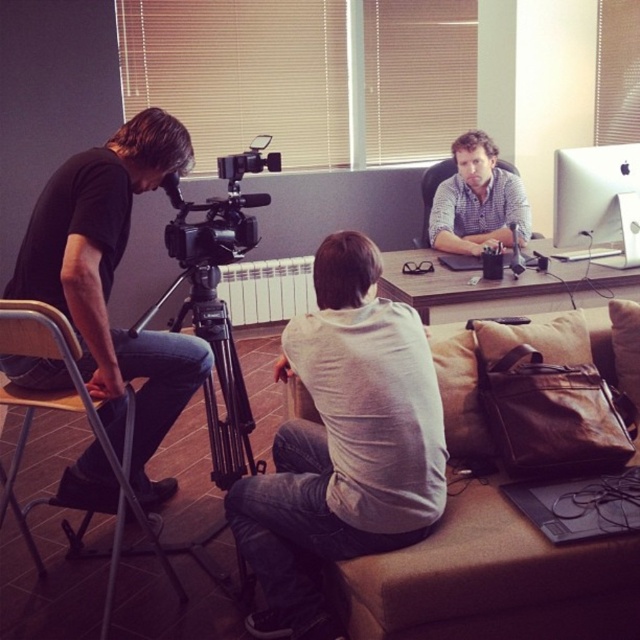
Question: Among these objects, which one is nearest to the camera?

Choices:
 (A) black metal tripod at left
 (B) wooden desk at center

Answer: (A)

Question: Among these points, which one is farthest from the camera?

Choices:
 (A) (529, 550)
 (B) (68, 296)

Answer: (B)

Question: Among these objects, which one is farthest from the camera?

Choices:
 (A) wooden desk at center
 (B) black metal tripod at left
 (C) white cotton shirt at center
 (D) checkered shirt at center

Answer: (D)

Question: Is white cotton shirt at center bigger than black matte camera at left?

Choices:
 (A) no
 (B) yes

Answer: (A)

Question: Does brown fabric couch at lower right have a smaller size compared to wooden desk at center?

Choices:
 (A) yes
 (B) no

Answer: (A)

Question: Is black metal tripod at left thinner than wooden desk at center?

Choices:
 (A) no
 (B) yes

Answer: (B)